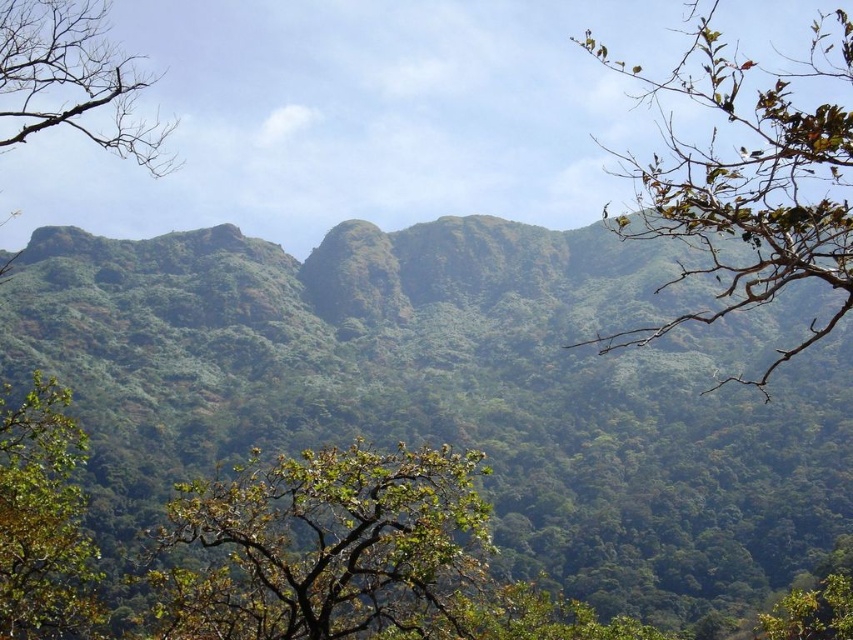
Question: Can you confirm if green leafy mountain at center is bigger than green leafy tree at lower left?

Choices:
 (A) yes
 (B) no

Answer: (A)

Question: Can you confirm if green leafy tree at lower left is positioned above green leafy tree at upper left?

Choices:
 (A) no
 (B) yes

Answer: (A)

Question: Which point is farther from the camera taking this photo?

Choices:
 (A) (28, 444)
 (B) (77, 61)
 (C) (421, 524)

Answer: (B)

Question: Where is green leafy tree at upper right located in relation to green leafy tree at upper left in the image?

Choices:
 (A) below
 (B) above

Answer: (A)

Question: Which object is the farthest from the green leafy tree at upper left?

Choices:
 (A) green leafy mountain at center
 (B) green leafy tree at center

Answer: (B)

Question: Among these objects, which one is nearest to the camera?

Choices:
 (A) green leafy mountain at center
 (B) green leafy tree at upper right

Answer: (B)